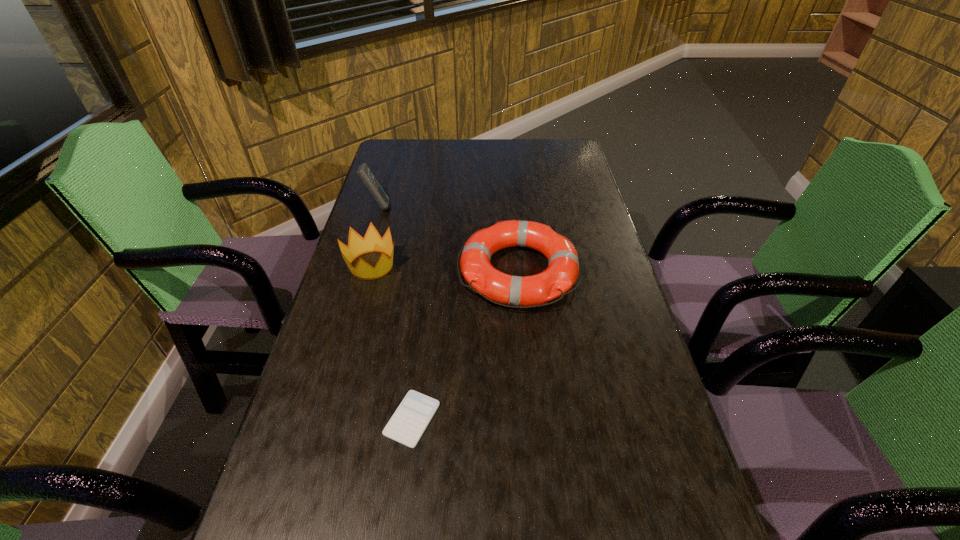
I want to click on free space between the crown and the second object from right to left, so click(x=392, y=342).

Locate an element on the screen. The image size is (960, 540). free space between the crown and the second object from right to left is located at coordinates (392, 342).

Locate an element on the screen. The height and width of the screenshot is (540, 960). free space between the shorter calculator and the second shortest object is located at coordinates (466, 345).

Where is `free area in between the tallest object and the second shortest object`? free area in between the tallest object and the second shortest object is located at coordinates (448, 239).

Locate an element on the screen. vacant region between the crown and the nearest object is located at coordinates (392, 342).

Find the location of `unoccupied position between the tallest object and the second shortest object`. unoccupied position between the tallest object and the second shortest object is located at coordinates (448, 239).

This screenshot has height=540, width=960. Find the location of `empty space between the crown and the nearest object`. empty space between the crown and the nearest object is located at coordinates coord(392,342).

The height and width of the screenshot is (540, 960). In order to click on the second closest object to the nearer calculator in this screenshot , I will do `click(372, 242)`.

Identify which object is located as the nearest to the farthest object. Please provide its 2D coordinates. Your answer should be formatted as a tuple, i.e. [(x, y)], where the tuple contains the x and y coordinates of a point satisfying the conditions above.

[(372, 242)]

Image resolution: width=960 pixels, height=540 pixels. Identify the location of vacant area in the image that satisfies the following two spatial constraints: 1. on the front-facing side of the crown; 2. on the left side of the taller calculator. (359, 265).